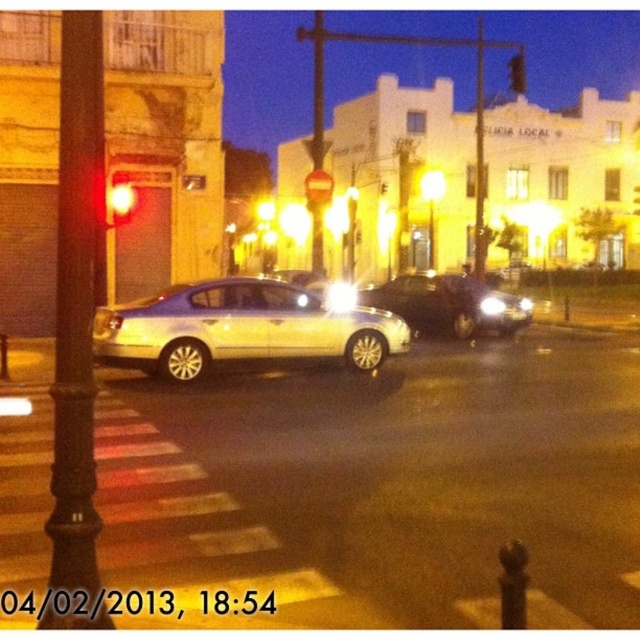
Is the position of satin black sedan at center less distant than that of metallic traffic light at upper center?

Yes, satin black sedan at center is in front of metallic traffic light at upper center.

At what (x,y) coordinates should I click in order to perform the action: click on satin black sedan at center. Please return your answer as a coordinate pair (x, y). Looking at the image, I should click on (449, 305).

Which is in front, point (106, 316) or point (516, 86)?

Point (106, 316) is in front.

Is satin white sedan at center smaller than metallic traffic light at upper center?

Indeed, satin white sedan at center has a smaller size compared to metallic traffic light at upper center.

The height and width of the screenshot is (640, 640). Describe the element at coordinates (241, 328) in the screenshot. I see `satin white sedan at center` at that location.

Locate an element on the screen. The width and height of the screenshot is (640, 640). satin white sedan at center is located at coordinates (241, 328).

Is point (138, 312) more distant than point (131, 212)?

No, (138, 312) is closer to viewer.

Locate an element on the screen. This screenshot has width=640, height=640. satin white sedan at center is located at coordinates (241, 328).

Consider the image. Who is more forward, (173, 332) or (125, 195)?

Positioned in front is point (173, 332).

At what (x,y) coordinates should I click in order to perform the action: click on satin white sedan at center. Please return your answer as a coordinate pair (x, y). The width and height of the screenshot is (640, 640). Looking at the image, I should click on (241, 328).